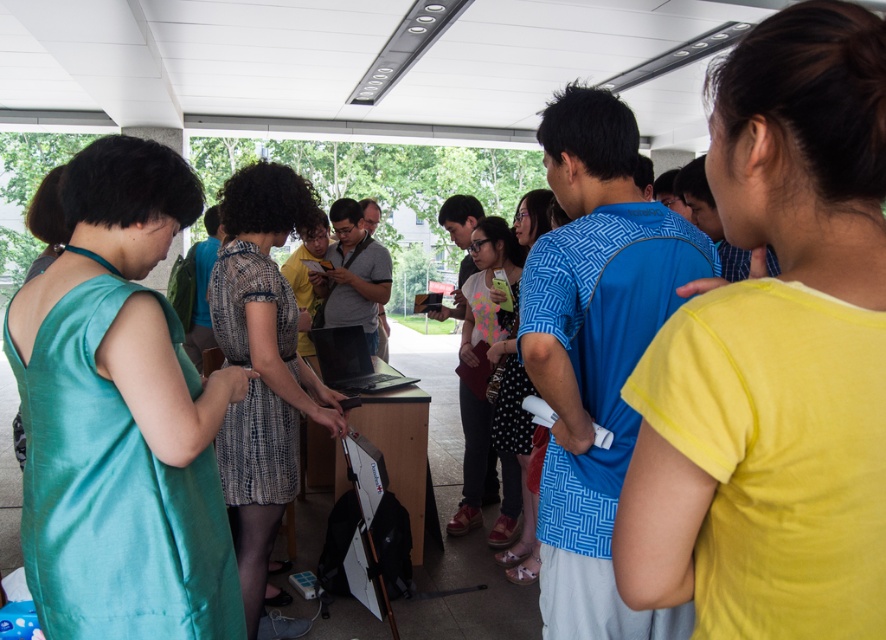
Does teal silk dress at left appear on the right side of patterned fabric dress at center?

No, teal silk dress at left is not to the right of patterned fabric dress at center.

Between point (68, 456) and point (514, 419), which one is positioned in front?

Point (68, 456) is in front.

Is point (65, 346) behind point (518, 449)?

That is False.

Identify the location of teal silk dress at left. (120, 417).

Does plaid fabric dress at center have a larger size compared to patterned fabric dress at center?

No, plaid fabric dress at center is not bigger than patterned fabric dress at center.

Locate an element on the screen. Image resolution: width=886 pixels, height=640 pixels. plaid fabric dress at center is located at coordinates (262, 364).

What do you see at coordinates (262, 364) in the screenshot?
I see `plaid fabric dress at center` at bounding box center [262, 364].

Locate an element on the screen. Image resolution: width=886 pixels, height=640 pixels. plaid fabric dress at center is located at coordinates (262, 364).

Is point (830, 465) closer to camera compared to point (84, 467)?

Yes, point (830, 465) is in front of point (84, 467).

Who is taller, yellow matte shirt at center or teal silk dress at left?

teal silk dress at left

Does point (811, 611) come in front of point (191, 435)?

That is True.

I want to click on yellow matte shirt at center, so click(775, 356).